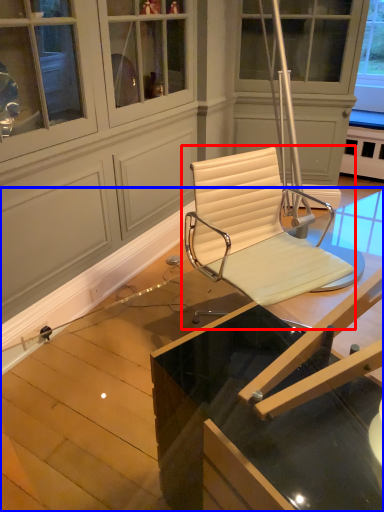
Question: Which point is closer to the camera, chair (highlighted by a red box) or table (highlighted by a blue box)?

Choices:
 (A) chair
 (B) table

Answer: (B)